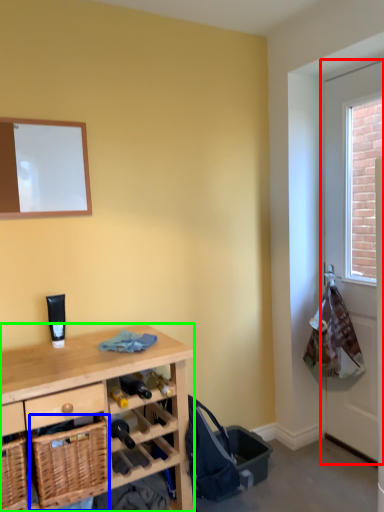
Question: Estimate the real-world distances between objects in this image. Which object is closer to screen door (highlighted by a red box), basket (highlighted by a blue box) or desk (highlighted by a green box)?

Choices:
 (A) basket
 (B) desk

Answer: (B)